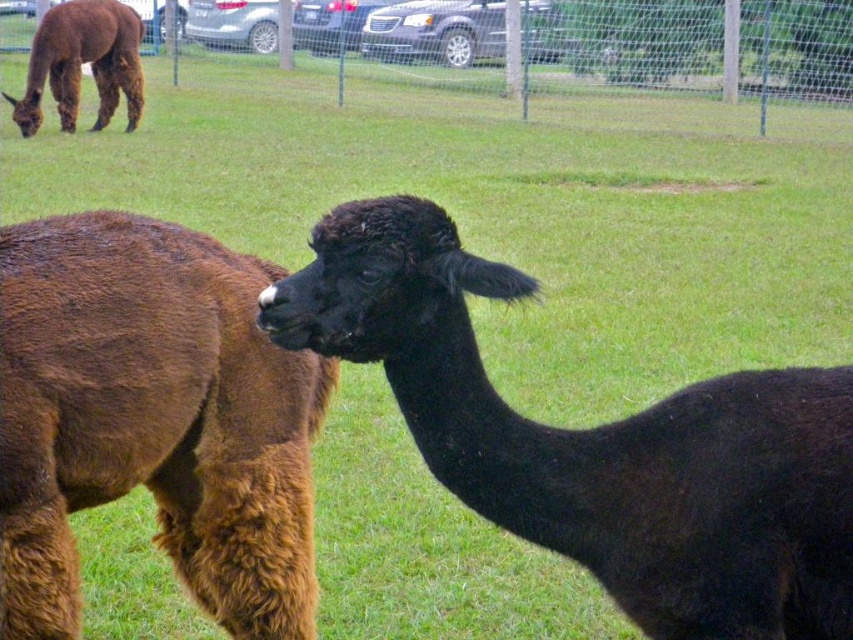
Who is positioned more to the right, black fuzzy alpaca at center or fence at upper center?

black fuzzy alpaca at center is more to the right.

This screenshot has width=853, height=640. What are the coordinates of `black fuzzy alpaca at center` in the screenshot? It's located at (596, 440).

You are a GUI agent. You are given a task and a screenshot of the screen. Output one action in this format:
    pyautogui.click(x=<x>, y=<y>)
    Task: Click on the black fuzzy alpaca at center
    
    Given the screenshot: What is the action you would take?
    pyautogui.click(x=596, y=440)

Which is more to the left, brown fuzzy camel at left or fence at upper center?

fence at upper center

Who is higher up, brown fuzzy camel at left or fence at upper center?

fence at upper center is higher up.

Who is more forward, (22, 560) or (479, 72)?

Point (22, 560) is in front.

Locate an element on the screen. The width and height of the screenshot is (853, 640). brown fuzzy camel at left is located at coordinates (151, 419).

Which is more to the left, black fuzzy alpaca at center or brown woolly alpaca at upper left?

Positioned to the left is brown woolly alpaca at upper left.

Does point (843, 637) come closer to viewer compared to point (136, 29)?

Yes, point (843, 637) is closer to viewer.

Which is in front, point (747, 502) or point (126, 67)?

Point (747, 502)

The image size is (853, 640). In order to click on black fuzzy alpaca at center in this screenshot , I will do coord(596,440).